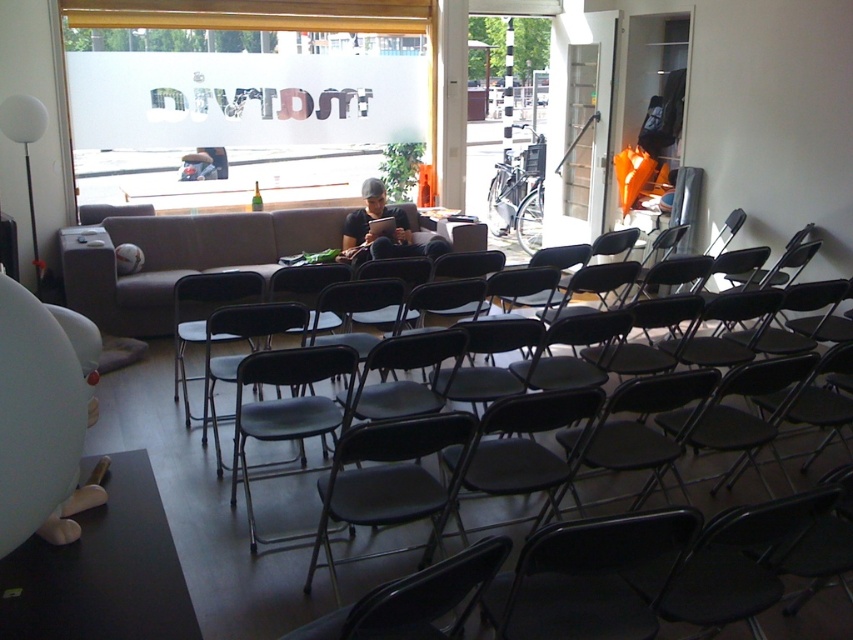
Question: Among these objects, which one is farthest from the camera?

Choices:
 (A) black metal folding chair at center
 (B) matte black chair at center

Answer: (A)

Question: Can you confirm if black metal folding chair at center is positioned to the right of matte black laptop at center?

Choices:
 (A) yes
 (B) no

Answer: (B)

Question: Estimate the real-world distances between objects in this image. Which object is closer to the matte black laptop at center?

Choices:
 (A) matte black chair at center
 (B) black metal folding chair at center
 (C) black metal chair at center

Answer: (B)

Question: Which of the following is the farthest from the observer?

Choices:
 (A) (253, 326)
 (B) (219, 289)
 (C) (349, 241)
 (D) (390, 282)

Answer: (C)

Question: Does black metal chair at center have a larger size compared to black metal folding chair at center?

Choices:
 (A) no
 (B) yes

Answer: (B)

Question: Can you confirm if matte black chair at center is wider than black metal folding chair at center?

Choices:
 (A) yes
 (B) no

Answer: (B)